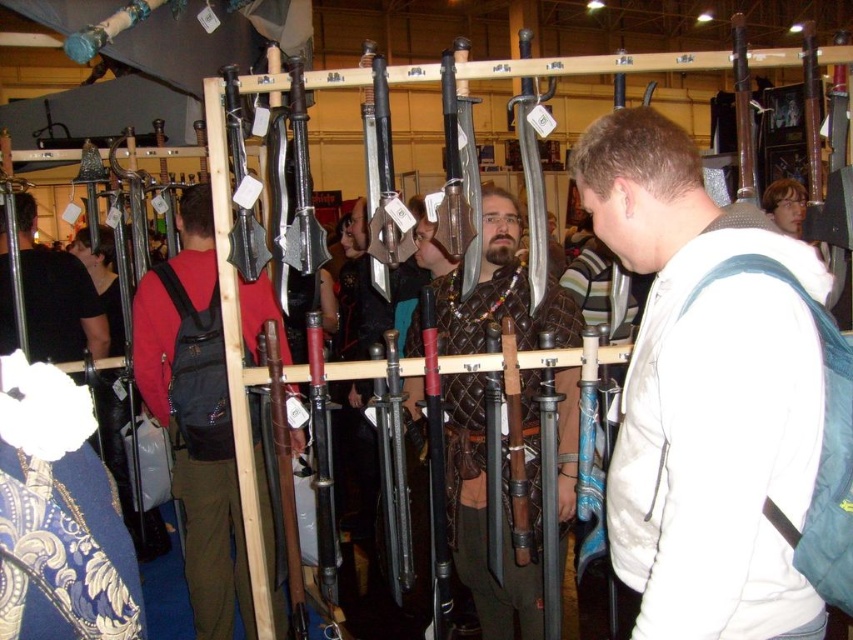
Question: Among these objects, which one is farthest from the camera?

Choices:
 (A) dark red backpack at center
 (B) white fabric backpack at center
 (C) matte black backpack at left
 (D) leather armor at center

Answer: (C)

Question: Can you confirm if leather armor at center is positioned below matte black backpack at left?

Choices:
 (A) yes
 (B) no

Answer: (A)

Question: Is white fabric backpack at center smaller than dark red backpack at center?

Choices:
 (A) yes
 (B) no

Answer: (A)

Question: Which of the following is the farthest from the observer?

Choices:
 (A) leather armor at center
 (B) matte black backpack at left
 (C) white fabric backpack at center

Answer: (B)

Question: Which object is positioned closest to the dark red backpack at center?

Choices:
 (A) leather armor at center
 (B) matte black backpack at left
 (C) white fabric backpack at center

Answer: (A)

Question: Is white fabric backpack at center positioned behind leather armor at center?

Choices:
 (A) yes
 (B) no

Answer: (B)